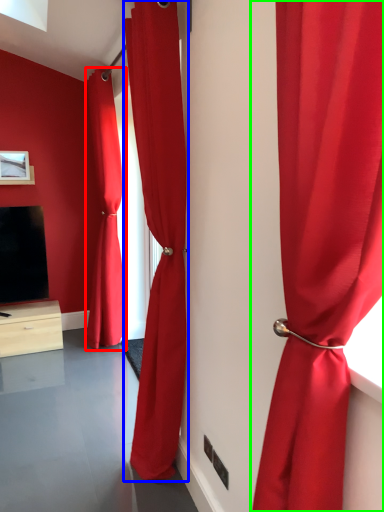
Question: Which object is positioned farthest from curtain (highlighted by a red box)? Select from curtain (highlighted by a blue box) and curtain (highlighted by a green box).

Choices:
 (A) curtain
 (B) curtain

Answer: (B)